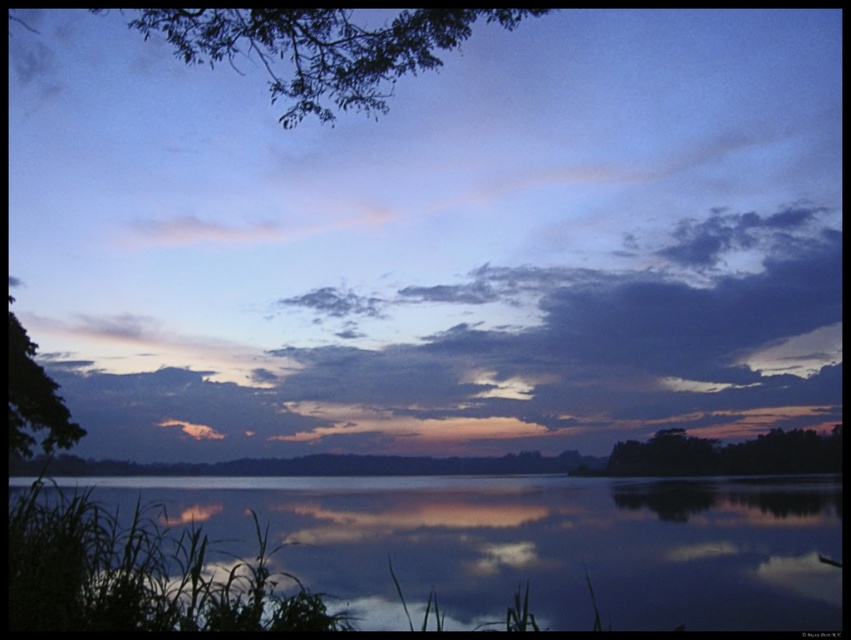
Is cloudy sky at upper center shorter than dark green leafy tree at right?

No, cloudy sky at upper center is not shorter than dark green leafy tree at right.

Between cloudy sky at upper center and dark green leafy tree at right, which one has more height?

cloudy sky at upper center

Who is more distant from viewer, [804,330] or [764,474]?

Point [804,330]

Locate an element on the screen. This screenshot has width=851, height=640. cloudy sky at upper center is located at coordinates (513, 356).

At what (x,y) coordinates should I click in order to perform the action: click on green leafy tree at upper left. Please return your answer as a coordinate pair (x, y). The height and width of the screenshot is (640, 851). Looking at the image, I should click on (318, 49).

Image resolution: width=851 pixels, height=640 pixels. Identify the location of green leafy tree at upper left. (318, 49).

Who is more distant from viewer, (791, 307) or (780, 497)?

The point (791, 307) is more distant.

Where is `cloudy sky at upper center`? The width and height of the screenshot is (851, 640). cloudy sky at upper center is located at coordinates (513, 356).